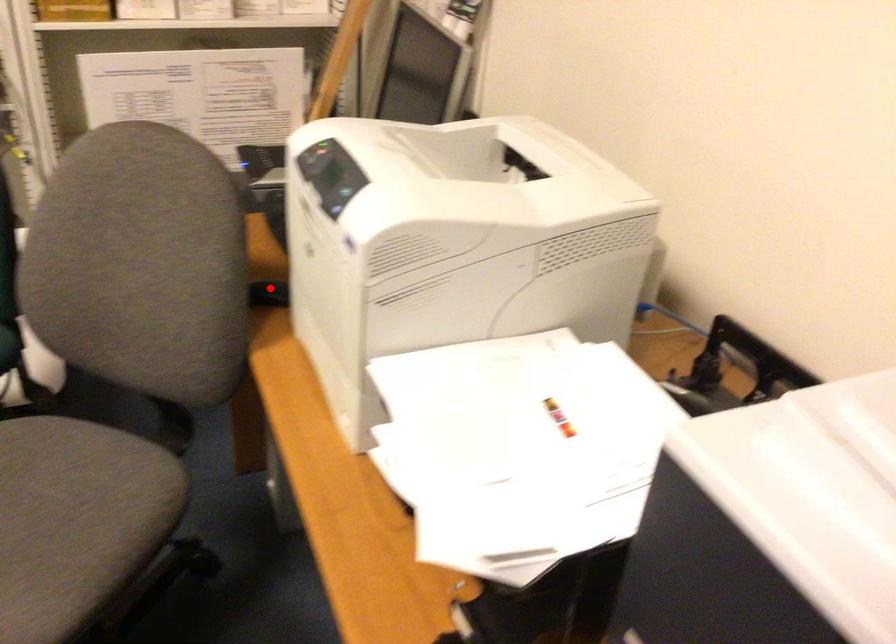
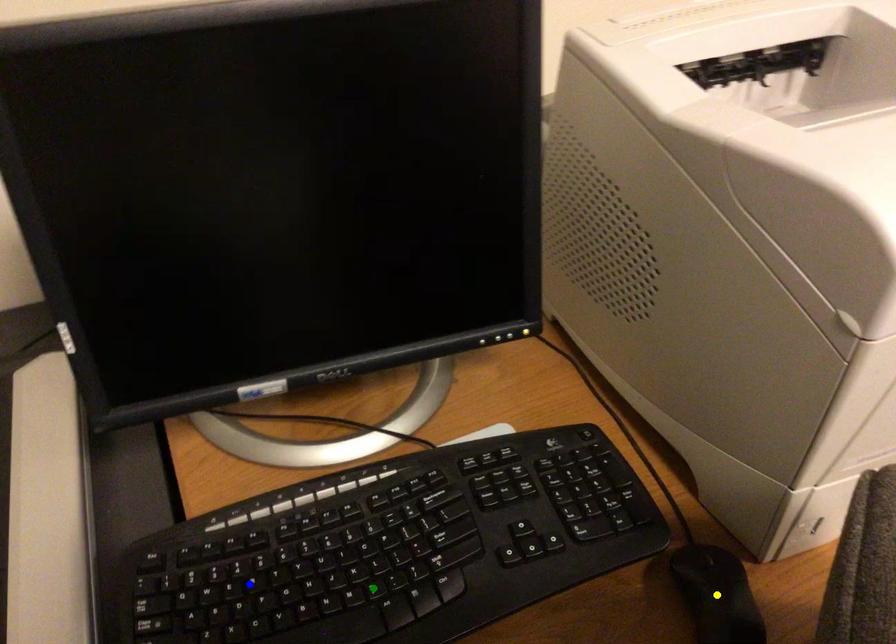
Question: I am providing you with two images of the same scene from different viewpoints. A red point is marked on the first image. You are given multiple points on the second image. Which mark in image 2 goes with the point in image 1?

Choices:
 (A) green point
 (B) yellow point
 (C) blue point

Answer: (B)